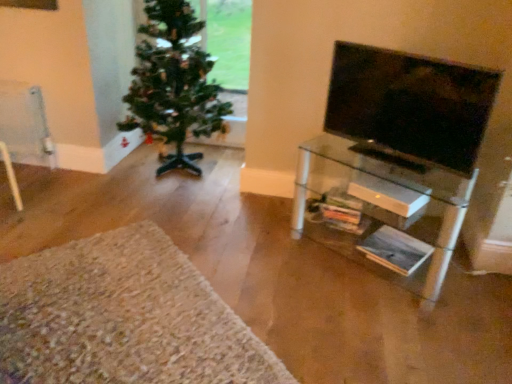
The height and width of the screenshot is (384, 512). I want to click on vacant area situated to the left side of clear glass shelf at right, so click(265, 250).